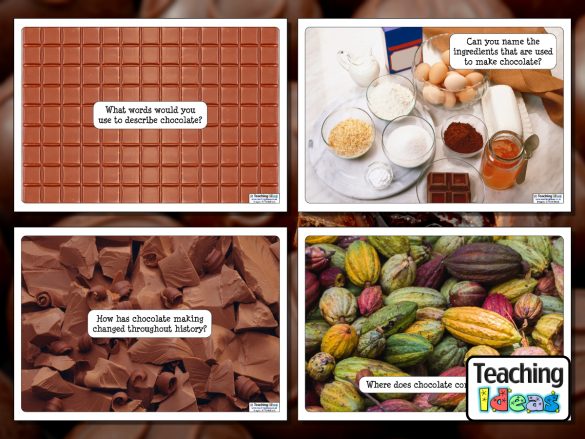
Find the location of a particular element. The width and height of the screenshot is (585, 439). spoon is located at coordinates (x=529, y=144).